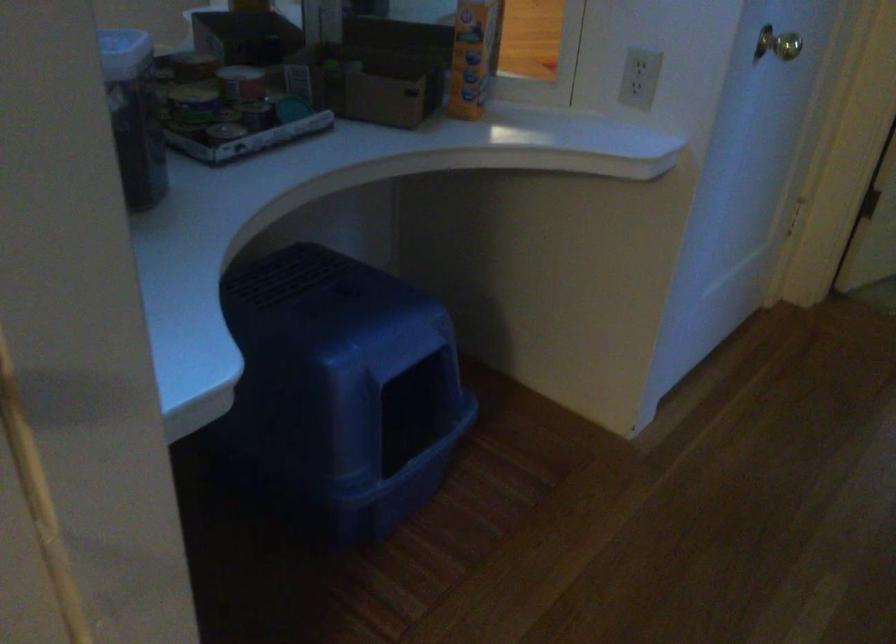
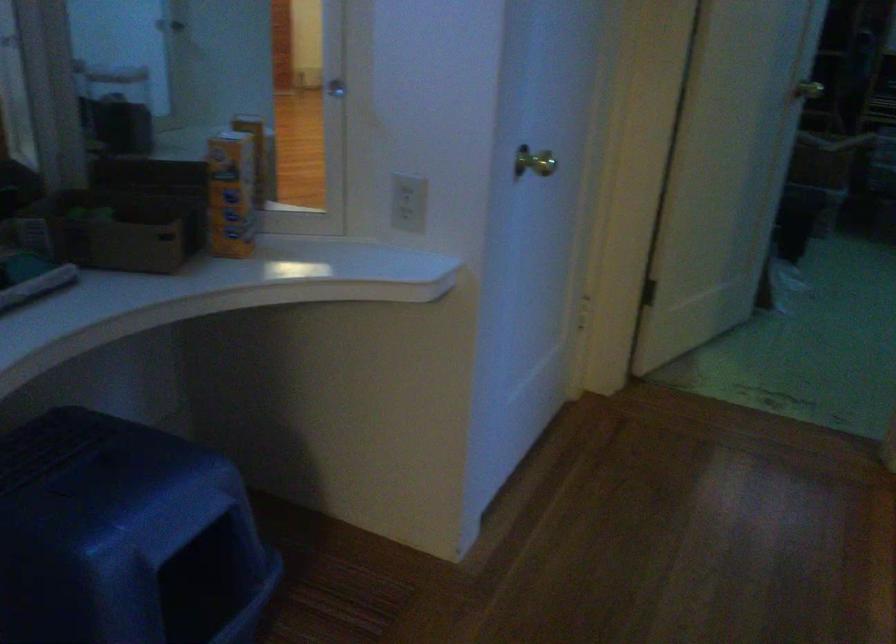
Question: The images are taken continuously from a first-person perspective. In which direction is your viewpoint rotating?

Choices:
 (A) Left
 (B) Right
 (C) Up
 (D) Down

Answer: (B)